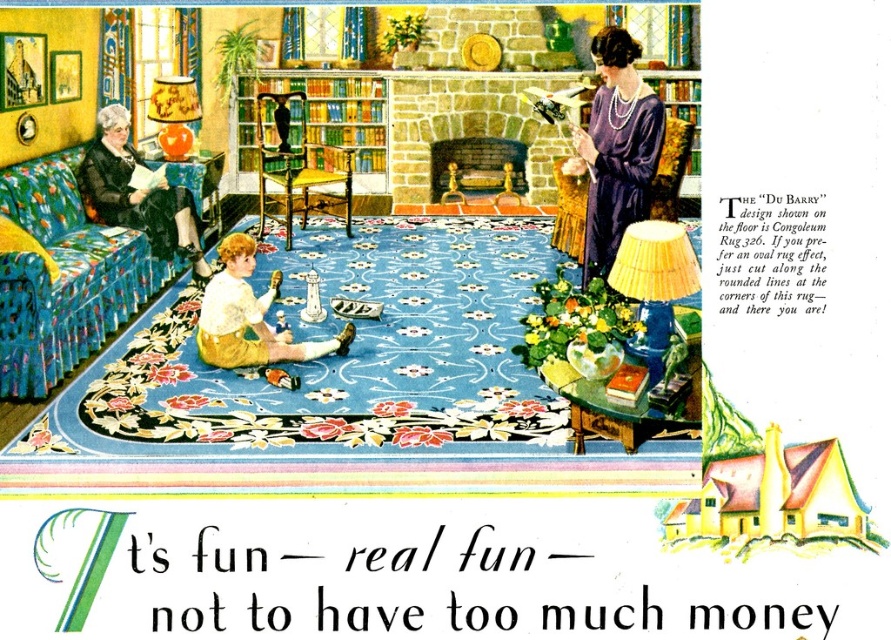
You are standing in the living room depicted in the Congoleum rug advertisement. You want to place a small decorative item at the point labeled as point (774,499). Based on the scene description, where exactly on the yellow painted wood house at center would this point be located?

The point (774,499) is located on the yellow painted wood house at center, which is part of the room decor in the vintage advertisement scene.

You are arranging a living room and want to place a new sofa and bookshelf. The floral fabric couch at left and the green glossy bookshelf at center are already in the room. Which object is located to the left of the other?

The floral fabric couch at left is positioned on the left side of the green glossy bookshelf at center.